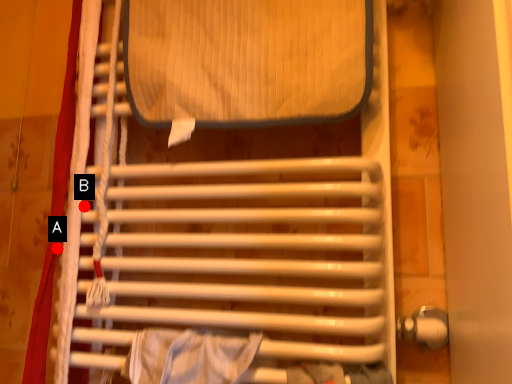
Question: Two points are circled on the image, labeled by A and B beside each circle. Among these points, which one is farthest from the camera?

Choices:
 (A) A is further
 (B) B is further

Answer: (B)